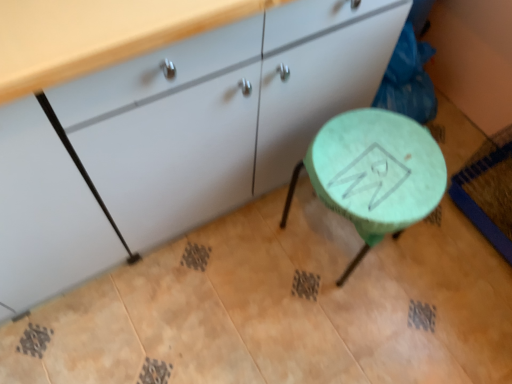
Find the location of a particular element. Image resolution: width=512 pixels, height=384 pixels. free space in front of green matte stool at center is located at coordinates (344, 326).